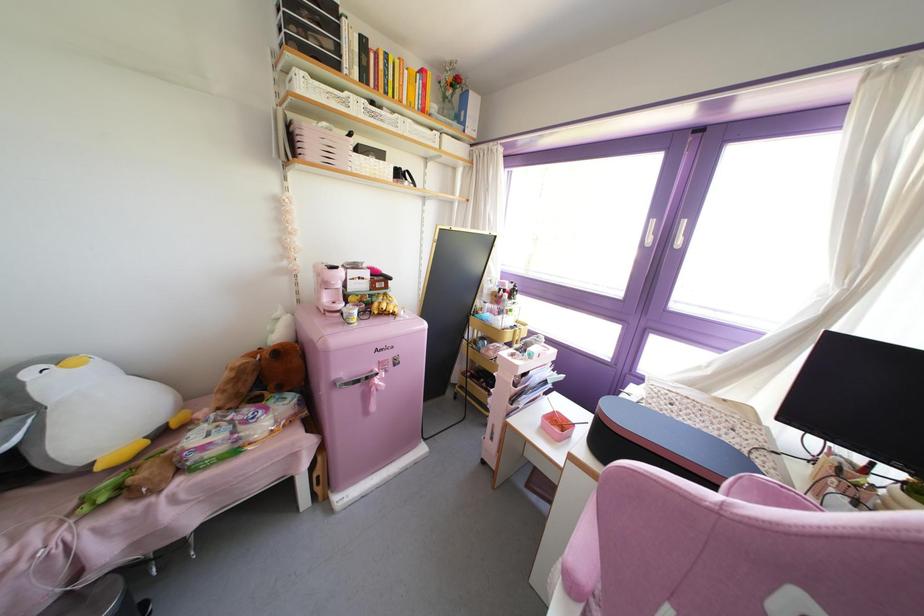
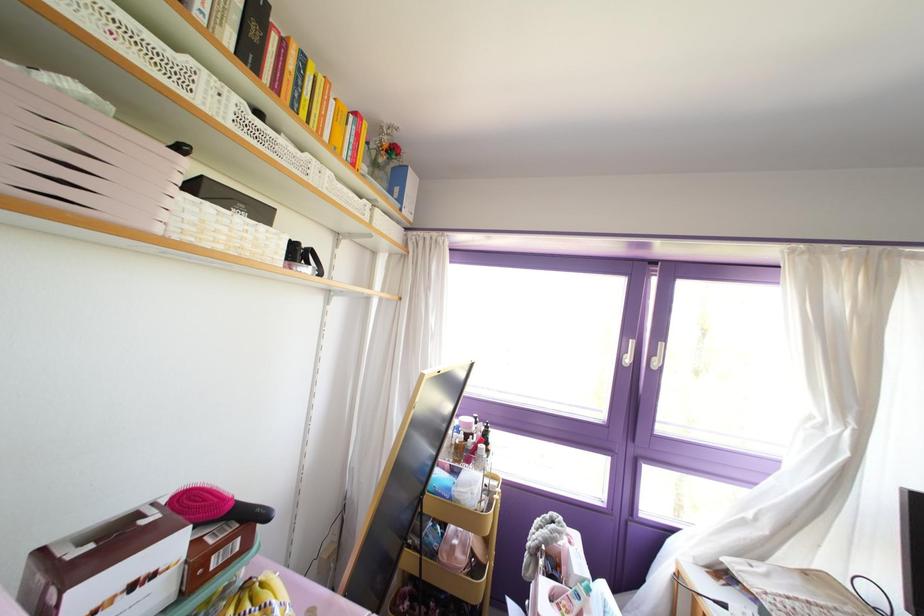
Find the pixel in the second image that matches (x=421, y=110) in the first image.

(351, 164)